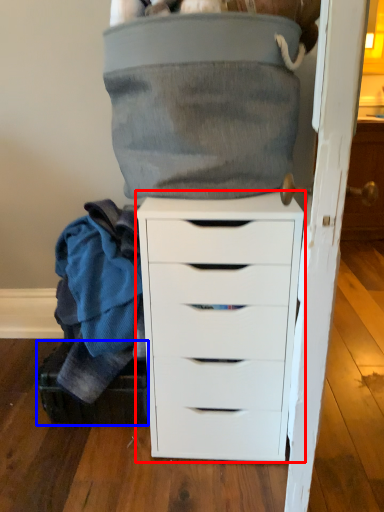
Question: Which of the following is the farthest to the observer, chest of drawers (highlighted by a red box) or shoe box (highlighted by a blue box)?

Choices:
 (A) chest of drawers
 (B) shoe box

Answer: (B)